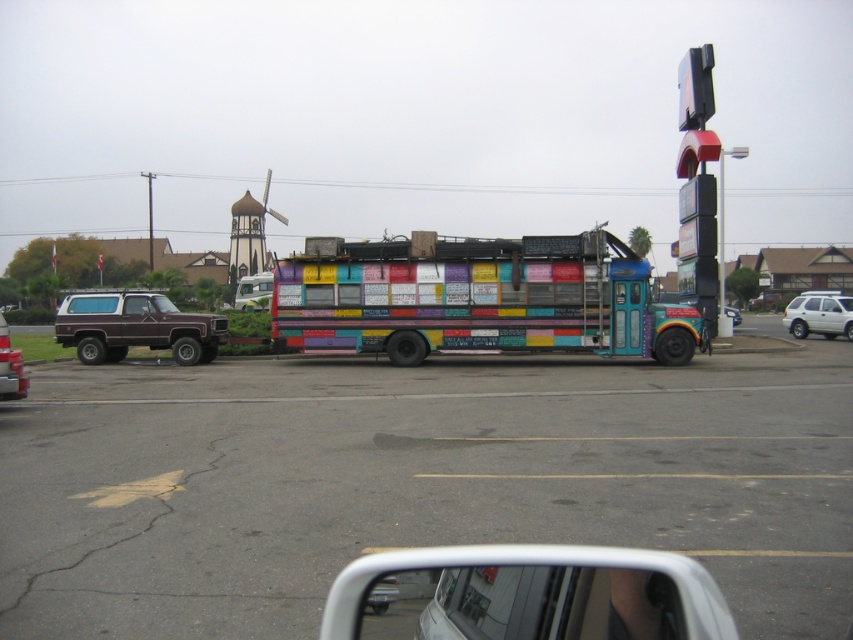
Question: Which point appears closest to the camera in this image?

Choices:
 (A) (384, 506)
 (B) (286, 324)

Answer: (A)

Question: Is multicolored painted bus at center positioned at the back of matte brown suv at left?

Choices:
 (A) no
 (B) yes

Answer: (B)

Question: Is brown matte truck at left above white matte car at right?

Choices:
 (A) yes
 (B) no

Answer: (B)

Question: Which object is positioned farthest from the matte brown suv at left?

Choices:
 (A) brown matte truck at left
 (B) multicolored painted bus at center

Answer: (B)

Question: Considering the relative positions of brown matte truck at left and white matte car at right in the image provided, where is brown matte truck at left located with respect to white matte car at right?

Choices:
 (A) below
 (B) above

Answer: (A)

Question: Which of the following is the closest to the observer?

Choices:
 (A) multicolored bus at center
 (B) white matte car at right

Answer: (A)